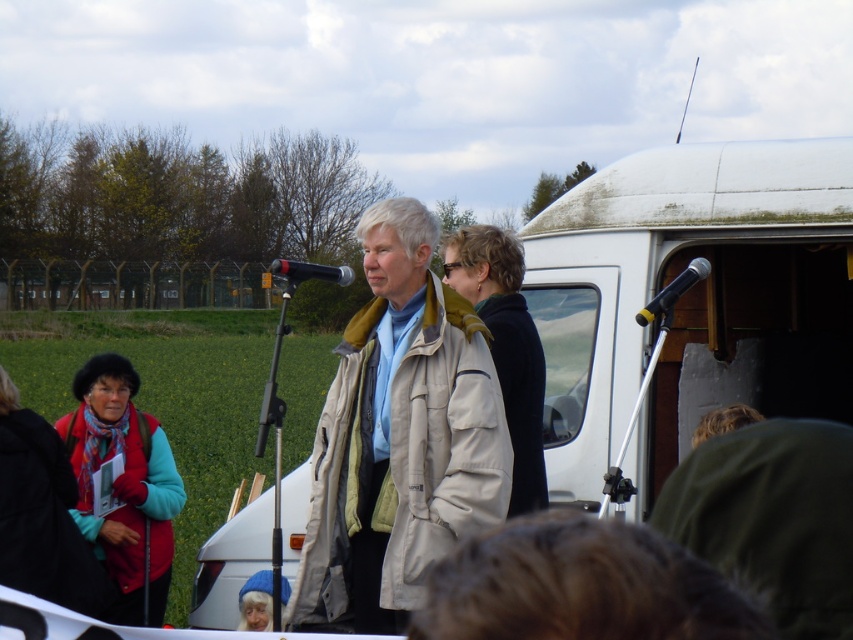
Between matte red vest at left and metallic silver microphone at upper right, which one is positioned higher?

metallic silver microphone at upper right is higher up.

Between point (165, 474) and point (682, 275), which one is positioned in front?

Point (682, 275) is in front.

Is point (94, 520) closer to camera compared to point (695, 280)?

No.

What are the coordinates of `matte red vest at left` in the screenshot? It's located at (125, 486).

Between matte red vest at left and matte black microphone at center, which one appears on the left side from the viewer's perspective?

matte black microphone at center

This screenshot has width=853, height=640. In order to click on matte red vest at left in this screenshot , I will do `click(125, 486)`.

Is point (119, 404) in front of point (287, 260)?

No, (119, 404) is behind (287, 260).

Where is `matte red vest at left`? This screenshot has height=640, width=853. matte red vest at left is located at coordinates (125, 486).

Can you confirm if beige fabric coat at center is bigger than matte black microphone at center?

No, beige fabric coat at center is not bigger than matte black microphone at center.

Is beige fabric coat at center above matte black microphone at center?

No.

Between point (358, 483) and point (283, 259), which one is positioned in front?

Point (358, 483) is more forward.

Where is `beige fabric coat at center`? Image resolution: width=853 pixels, height=640 pixels. beige fabric coat at center is located at coordinates (399, 436).